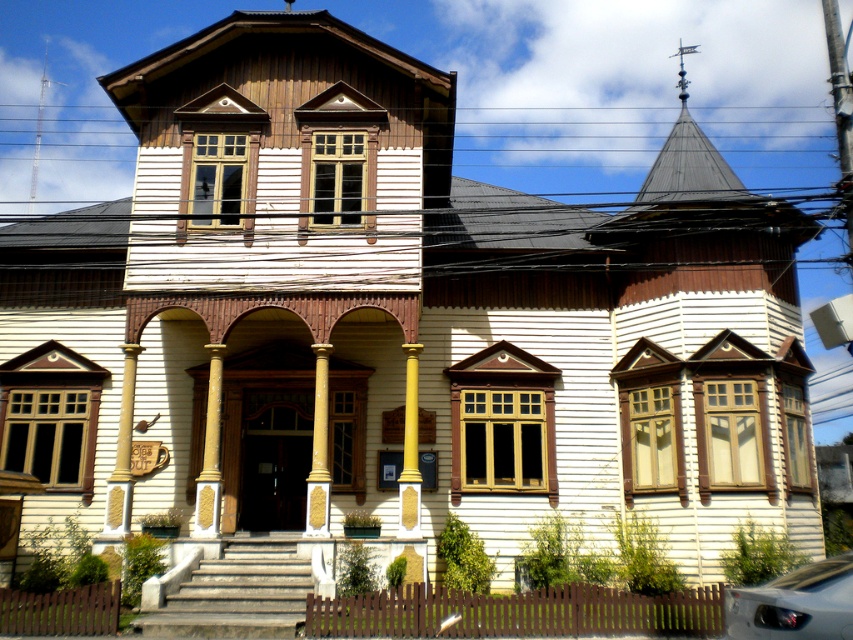
You are standing in front of the two story wooden building. There is a yellow polished column at center at point (410, 449). Is the column to the left or right of the center of the building?

The yellow polished column at center is exactly at the center of the building as it is located at point (410, 449) which is the central coordinate.

You are a delivery person approaching the building and need to reach the front door. The path to the door is blocked by an object. Which object must you go around or move past first, the stone steps at center or the yellow polished column at center?

The stone steps at center is in front of the yellow polished column at center, so you must go around or move past the stone steps at center first to reach the front door.

You are standing in front of the two story wooden building and want to walk up the stone steps at center. Which direction should you move relative to the yellow polished wood column at center?

The stone steps at center is to the right of yellow polished wood column at center, so you should move to the right of the yellow polished wood column at center to reach the stone steps at center.